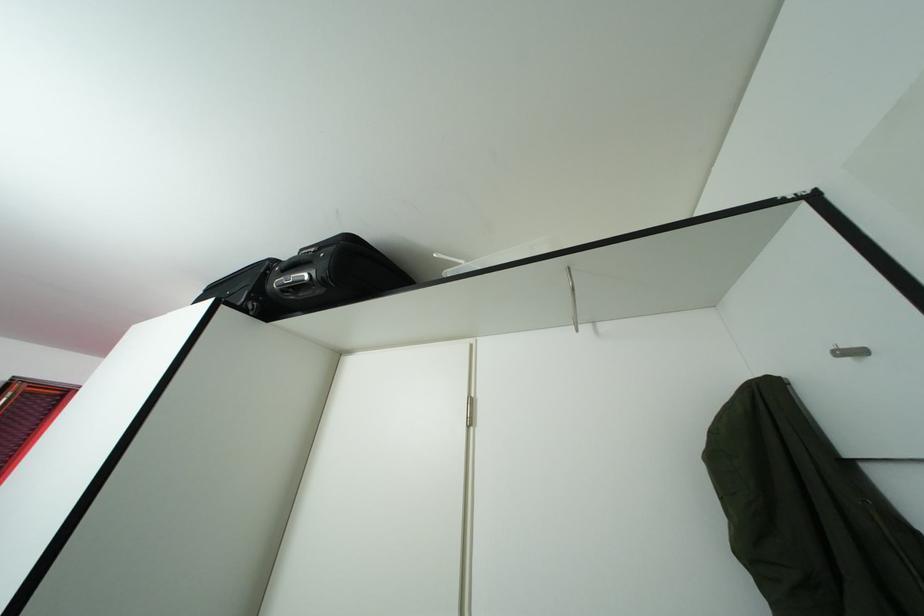
Describe the element at coordinates (849, 352) in the screenshot. Image resolution: width=924 pixels, height=616 pixels. I see `the small metal hook` at that location.